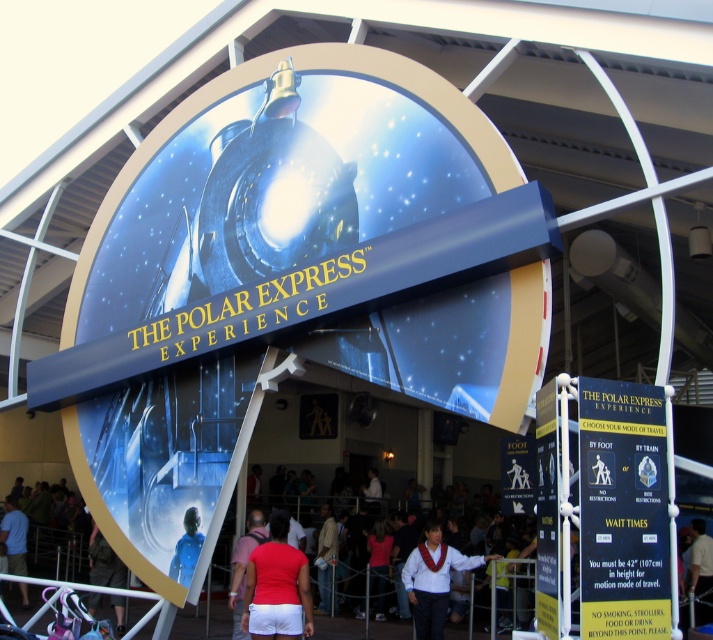
Is black plastic sign at center thinner than white satin vest at center?

Correct, black plastic sign at center's width is less than white satin vest at center's.

Who is more forward, (602, 390) or (415, 554)?

Point (602, 390) is more forward.

Image resolution: width=713 pixels, height=640 pixels. I want to click on black plastic sign at center, so click(622, 509).

The width and height of the screenshot is (713, 640). I want to click on black plastic sign at center, so click(622, 509).

Where is `matte red shirt at center`? The image size is (713, 640). matte red shirt at center is located at coordinates (277, 588).

Is point (279, 576) positioned after point (689, 552)?

No, it is in front of (689, 552).

Locate an element on the screen. matte red shirt at center is located at coordinates (277, 588).

Is the position of black plastic sign at center less distant than that of dark blue shirt at lower left?

Yes, black plastic sign at center is closer to the viewer.

Locate an element on the screen. Image resolution: width=713 pixels, height=640 pixels. black plastic sign at center is located at coordinates (622, 509).